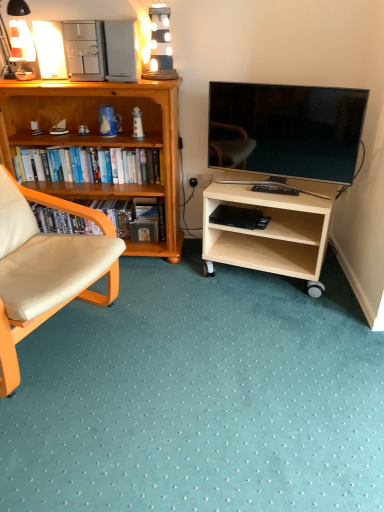
Where is `vacant region to the left of light wood/finished wood tv stand at lower right, which ranks as the first desk in right-to-left order`? vacant region to the left of light wood/finished wood tv stand at lower right, which ranks as the first desk in right-to-left order is located at coordinates (188, 288).